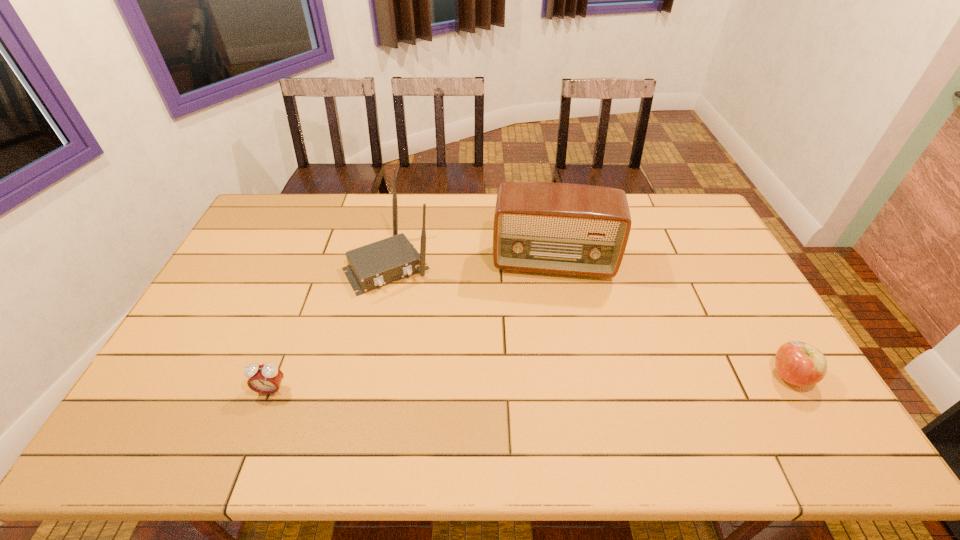
Find the location of a particular element. The width and height of the screenshot is (960, 540). the leftmost object is located at coordinates (265, 379).

This screenshot has height=540, width=960. In order to click on apple in this screenshot , I will do `click(798, 363)`.

Locate an element on the screen. This screenshot has width=960, height=540. the third object from left to right is located at coordinates (558, 228).

Identify the location of the second object from left to right. Image resolution: width=960 pixels, height=540 pixels. (374, 265).

At what (x,y) coordinates should I click in order to perform the action: click on free location located 0.340m on the left of the apple. Please return your answer as a coordinate pair (x, y). Looking at the image, I should click on (638, 377).

Image resolution: width=960 pixels, height=540 pixels. In order to click on vacant space located on the front-facing side of the radio receiver in this screenshot , I will do `click(549, 336)`.

The width and height of the screenshot is (960, 540). In order to click on free space located on the front-facing side of the radio receiver in this screenshot , I will do `click(549, 396)`.

Locate an element on the screen. The height and width of the screenshot is (540, 960). vacant space located on the front-facing side of the radio receiver is located at coordinates (549, 318).

Where is `vacant space located on the back of the third object from right to left to connect cables`? This screenshot has height=540, width=960. vacant space located on the back of the third object from right to left to connect cables is located at coordinates (459, 373).

You are a GUI agent. You are given a task and a screenshot of the screen. Output one action in this format:
    pyautogui.click(x=<x>, y=<y>)
    Task: Click on the vacant space located on the back of the third object from right to left to connect cables
    The width and height of the screenshot is (960, 540).
    Given the screenshot: What is the action you would take?
    pyautogui.click(x=454, y=365)